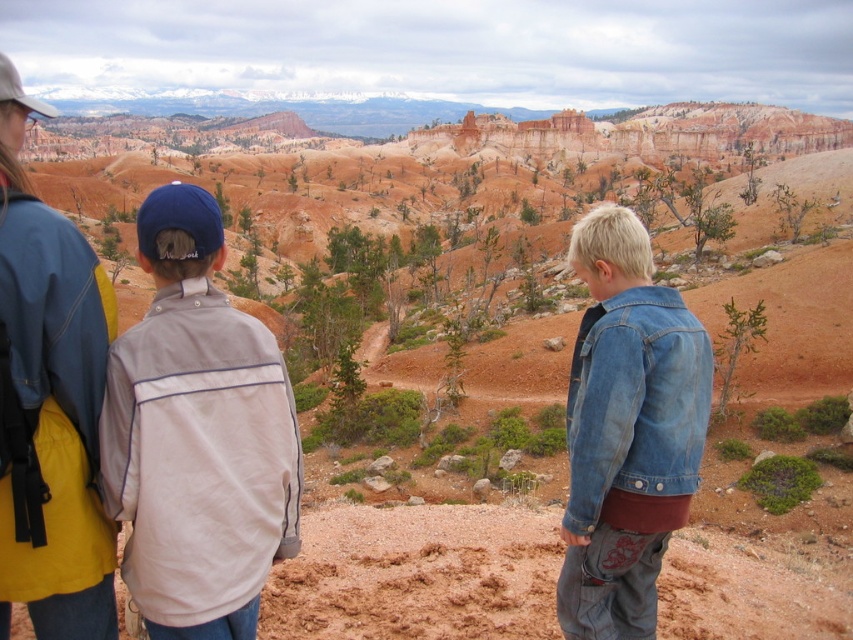
You are a photographer positioned at the vantage point in the scene. You want to capture a photo that includes both the light gray fabric jacket at center left and the denim jacket at lower right. Which jacket should you adjust your camera angle to focus on first to ensure both are in the frame?

Result: The light gray fabric jacket at center left is in front of the denim jacket at lower right, so you should focus on the light gray fabric jacket at center left first to ensure both are visible in the frame.

You are an observer standing at the same vantage point as the group. You notice two jackets among the people. Which jacket is smaller in size between the light gray fabric jacket at center left and the brushed metal jacket at upper left?

The light gray fabric jacket at center left is smaller in size compared to the brushed metal jacket at upper left.